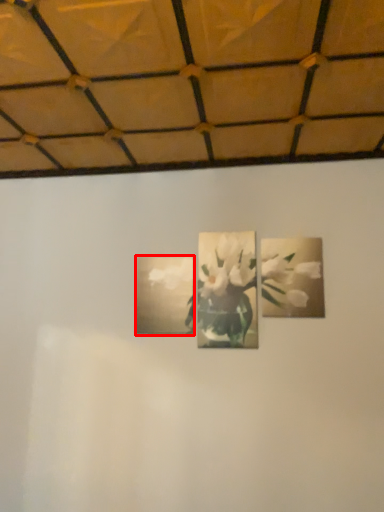
Question: From the image's perspective, where is picture frame (annotated by the red box) located relative to flower?

Choices:
 (A) below
 (B) above

Answer: (A)